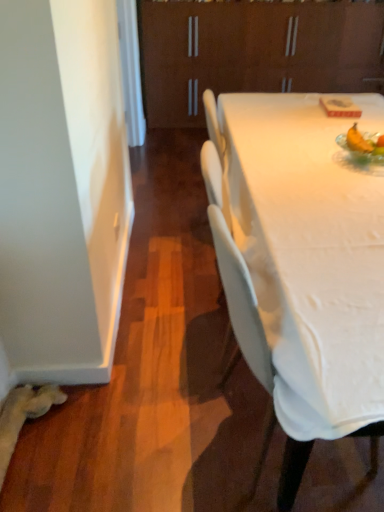
This screenshot has width=384, height=512. What do you see at coordinates (244, 323) in the screenshot?
I see `white plastic chair at center` at bounding box center [244, 323].

You are a GUI agent. You are given a task and a screenshot of the screen. Output one action in this format:
    pyautogui.click(x=<x>, y=<y>)
    Task: Click on the brown matte cabinet at upper center
    
    Given the screenshot: What is the action you would take?
    pyautogui.click(x=254, y=52)

In terms of height, does translucent glass bowl at upper right look taller or shorter compared to white plastic chair at center?

In the image, translucent glass bowl at upper right appears to be shorter than white plastic chair at center.

Between translucent glass bowl at upper right and white plastic chair at center, which one is positioned in front?

white plastic chair at center.

From a real-world perspective, is translucent glass bowl at upper right positioned above or below white plastic chair at center?

translucent glass bowl at upper right is situated higher than white plastic chair at center in the real world.

In terms of width, does white plastic chair at center look wider or thinner when compared to brown matte cabinet at upper center?

In the image, white plastic chair at center appears to be wider than brown matte cabinet at upper center.

In the image, is white plastic chair at center positioned in front of or behind brown matte cabinet at upper center?

white plastic chair at center is positioned closer to the viewer than brown matte cabinet at upper center.

Measure the distance between white plastic chair at center and brown matte cabinet at upper center.

The distance of white plastic chair at center from brown matte cabinet at upper center is 3.78 meters.

In the scene shown: Would you say white plastic chair at center is outside brown matte cabinet at upper center?

Yes, white plastic chair at center is outside of brown matte cabinet at upper center.

From the image's perspective, who appears lower, translucent glass bowl at upper right or brown matte cabinet at upper center?

translucent glass bowl at upper right is shown below in the image.

Could you tell me if translucent glass bowl at upper right is facing brown matte cabinet at upper center?

Yes, translucent glass bowl at upper right is oriented towards brown matte cabinet at upper center.

Can you see translucent glass bowl at upper right touching brown matte cabinet at upper center?

No, translucent glass bowl at upper right is not making contact with brown matte cabinet at upper center.

Is translucent glass bowl at upper right to the right of brown matte cabinet at upper center from the viewer's perspective?

No.

Is the depth of white plastic chair at center less than that of translucent glass bowl at upper right?

Yes.

From a real-world perspective, is white plastic chair at center above or below translucent glass bowl at upper right?

white plastic chair at center is below translucent glass bowl at upper right.

Do you think white plastic chair at center is within translucent glass bowl at upper right, or outside of it?

white plastic chair at center exists outside the volume of translucent glass bowl at upper right.

The image size is (384, 512). What are the coordinates of `chair located on the left of translucent glass bowl at upper right` in the screenshot? It's located at (244, 323).

Considering the positions of points (153, 24) and (337, 139), is point (153, 24) farther from camera compared to point (337, 139)?

Yes, point (153, 24) is farther from viewer.

Is brown matte cabinet at upper center aimed at translucent glass bowl at upper right?

Yes, brown matte cabinet at upper center faces towards translucent glass bowl at upper right.

Based on the photo, is white plastic chair at center located within brown matte cabinet at upper center?

No, white plastic chair at center is located outside of brown matte cabinet at upper center.

Can you confirm if brown matte cabinet at upper center is wider than white plastic chair at center?

No.

Is the depth of brown matte cabinet at upper center greater than that of white plastic chair at center?

Yes.

Is brown matte cabinet at upper center touching white plastic chair at center?

No, brown matte cabinet at upper center is not next to white plastic chair at center.

In the image, there is a translucent glass bowl at upper right. Where is `chair below it (from a real-world perspective)`? This screenshot has height=512, width=384. chair below it (from a real-world perspective) is located at coordinates pos(244,323).

At what (x,y) coordinates should I click in order to perform the action: click on cabinetry that appears behind the white plastic chair at center. Please return your answer as a coordinate pair (x, y). The image size is (384, 512). Looking at the image, I should click on (254, 52).

Looking at the image, which one is located closer to brown matte cabinet at upper center, translucent glass bowl at upper right or white plastic chair at center?

Based on the image, translucent glass bowl at upper right appears to be nearer to brown matte cabinet at upper center.

Estimate the real-world distances between objects in this image. Which object is further from brown matte cabinet at upper center, white plastic chair at center or translucent glass bowl at upper right?

white plastic chair at center lies further to brown matte cabinet at upper center than the other object.

From the image, which object appears to be nearer to white plastic chair at center, brown matte cabinet at upper center or translucent glass bowl at upper right?

translucent glass bowl at upper right is positioned closer to the anchor white plastic chair at center.

Which object lies further to the anchor point translucent glass bowl at upper right, brown matte cabinet at upper center or white plastic chair at center?

brown matte cabinet at upper center.

Considering their positions, is translucent glass bowl at upper right positioned further to white plastic chair at center than brown matte cabinet at upper center?

Based on the image, brown matte cabinet at upper center appears to be further to white plastic chair at center.

Considering their positions, is white plastic chair at center positioned closer to translucent glass bowl at upper right than brown matte cabinet at upper center?

white plastic chair at center is closer to translucent glass bowl at upper right.

Locate an element on the screen. The image size is (384, 512). food between white plastic chair at center and brown matte cabinet at upper center in the front-back direction is located at coordinates (363, 145).